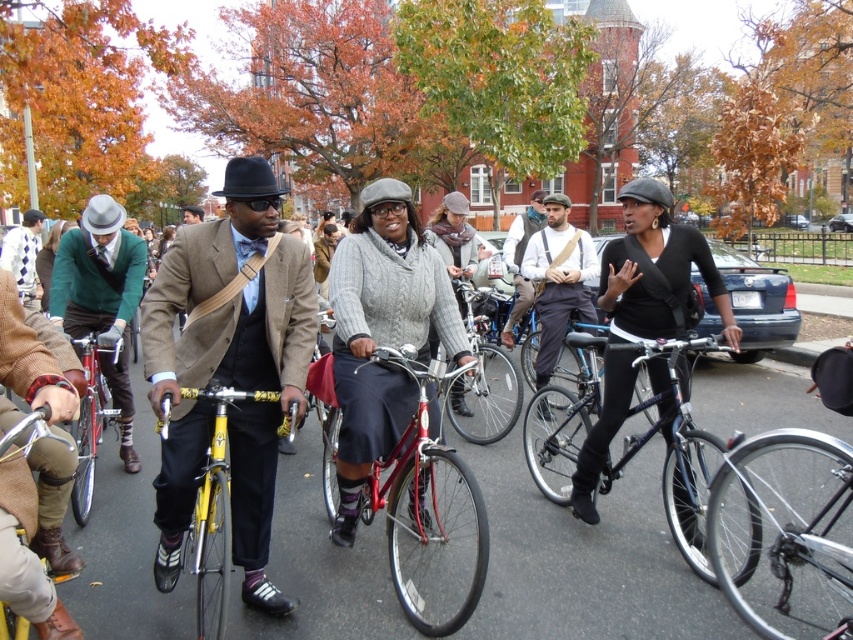
You are a photographer positioned to capture the entire scene. You want to ensure both the shiny red bicycle at center and the shiny metallic bicycle at left are clearly visible in your photo. Based on their positions, which bicycle should you focus on first to ensure it appears sharp in the foreground?

The shiny red bicycle at center should be focused on first since it is in front of the shiny metallic bicycle at left, making it closer to the camera and thus the foreground element.

You are a photographer standing at the edge of the scene. You want to capture a photo that includes both the matte brown leather jacket at center and the shiny black bicycle at center. What is the minimum distance you need to move backward to ensure both are fully in frame?

The minimum distance to move backward should be greater than 2.22 meters to ensure both the matte brown leather jacket at center and the shiny black bicycle at center are fully captured in the frame.